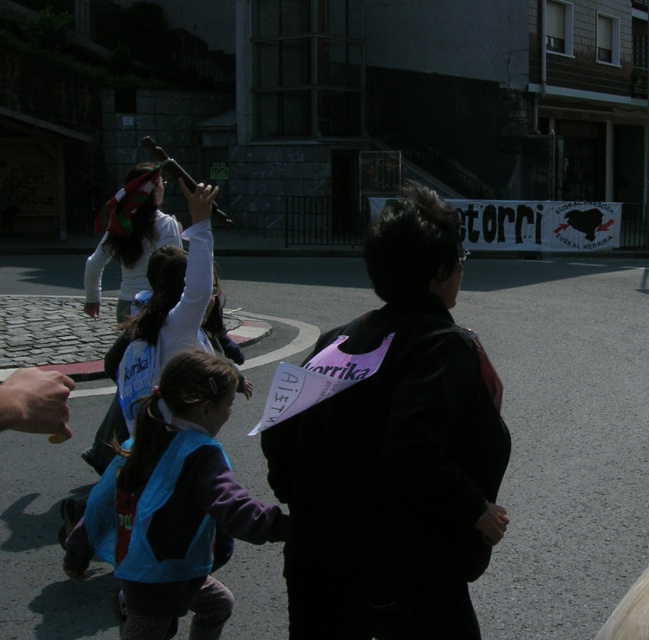
Question: Can you confirm if black fabric at center is smaller than white cotton shirt at upper left?

Choices:
 (A) no
 (B) yes

Answer: (B)

Question: Can you confirm if black fabric at center is thinner than white cotton shirt at upper left?

Choices:
 (A) no
 (B) yes

Answer: (B)

Question: Which point is farther from the camera taking this photo?

Choices:
 (A) (164, 476)
 (B) (171, 241)

Answer: (B)

Question: Is blue fabric vest at lower left smaller than white cotton shirt at upper left?

Choices:
 (A) no
 (B) yes

Answer: (B)

Question: Based on their relative distances, which object is nearer to the blue fabric vest at lower left?

Choices:
 (A) white cotton shirt at upper left
 (B) black fabric at center

Answer: (B)

Question: Which point is closer to the camera taking this photo?

Choices:
 (A) 472,408
 (B) 186,433
 (C) 104,426

Answer: (A)